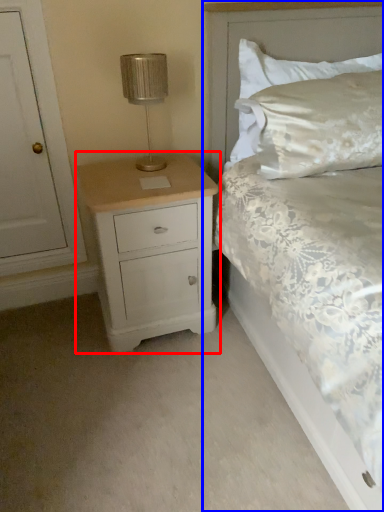
Question: Which point is further to the camera, chest of drawers (highlighted by a red box) or bed (highlighted by a blue box)?

Choices:
 (A) chest of drawers
 (B) bed

Answer: (A)